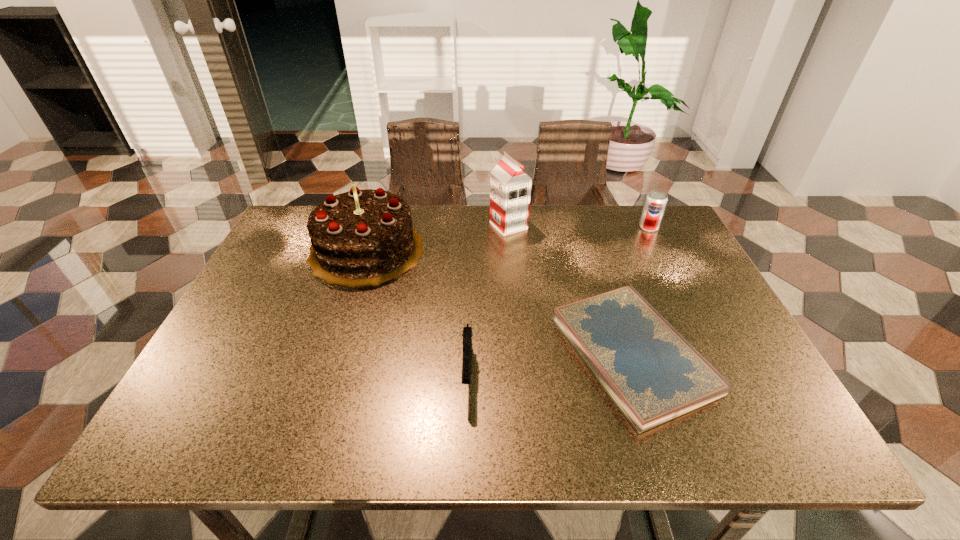
Find the location of a particular element. the third object from right to left is located at coordinates (510, 187).

The width and height of the screenshot is (960, 540). What are the coordinates of `birthday cake` in the screenshot? It's located at (365, 237).

Where is `the third tallest object`? This screenshot has width=960, height=540. the third tallest object is located at coordinates (656, 201).

This screenshot has width=960, height=540. I want to click on the second object from left to right, so click(x=467, y=334).

Where is `the second shortest object`? Image resolution: width=960 pixels, height=540 pixels. the second shortest object is located at coordinates (467, 334).

The width and height of the screenshot is (960, 540). Identify the location of the shortest object. (652, 373).

Locate an element on the screen. This screenshot has height=540, width=960. blank area located on the left of the soya milk is located at coordinates (377, 226).

At what (x,y) coordinates should I click in order to perform the action: click on vacant space located 0.130m on the front of the leftmost object. Please return your answer as a coordinate pair (x, y). Looking at the image, I should click on (343, 325).

Where is `free space located on the back of the soda`? This screenshot has width=960, height=540. free space located on the back of the soda is located at coordinates (641, 211).

You are a GUI agent. You are given a task and a screenshot of the screen. Output one action in this format:
    pyautogui.click(x=<x>, y=<y>)
    Task: Click on the free space located on the back of the paperback book
    
    Given the screenshot: What is the action you would take?
    pyautogui.click(x=587, y=217)